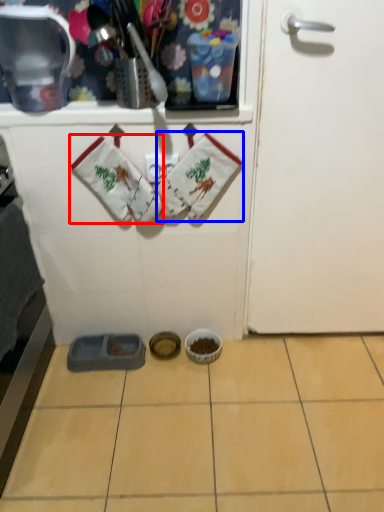
Question: Which point is further to the camera, baby clothe (highlighted by a red box) or baby clothe (highlighted by a blue box)?

Choices:
 (A) baby clothe
 (B) baby clothe

Answer: (B)